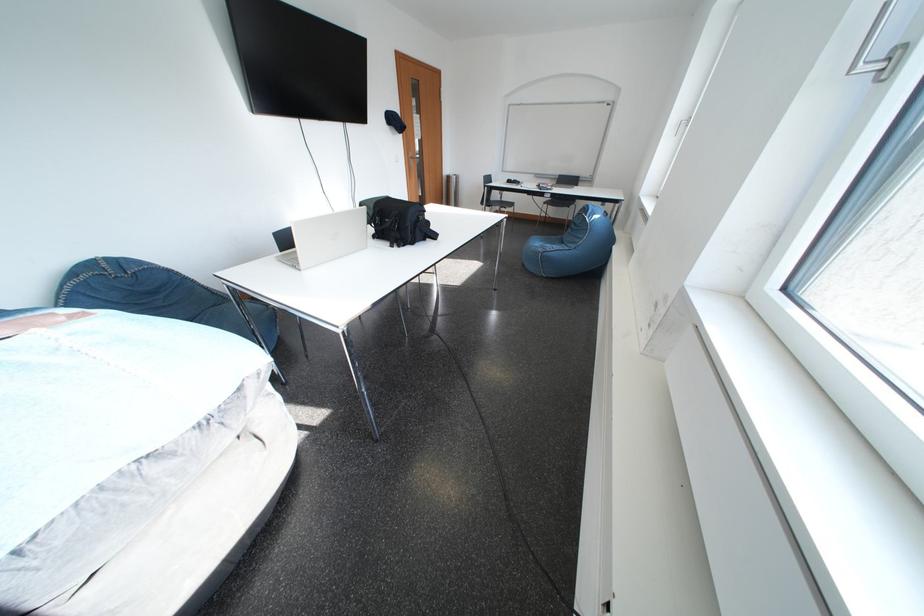
The location [451,188] corresponds to which object?

It refers to a silver trash can.